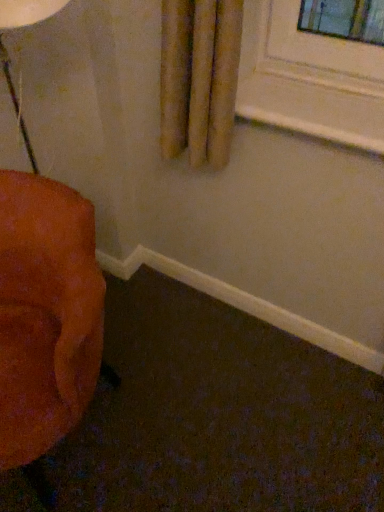
You are a GUI agent. You are given a task and a screenshot of the screen. Output one action in this format:
    pyautogui.click(x=<x>, y=<y>)
    Task: Click on the velvet orange chair at left
    
    Given the screenshot: What is the action you would take?
    pyautogui.click(x=46, y=314)

Image resolution: width=384 pixels, height=512 pixels. Describe the element at coordinates (46, 314) in the screenshot. I see `velvet orange chair at left` at that location.

Identify the location of white painted wood at upper center. (311, 130).

This screenshot has height=512, width=384. What do you see at coordinates (311, 130) in the screenshot?
I see `white painted wood at upper center` at bounding box center [311, 130].

Find the location of a particular element. This screenshot has width=384, height=512. velvet orange chair at left is located at coordinates (46, 314).

Between white painted wood at upper center and velvet orange chair at left, which one appears on the right side from the viewer's perspective?

white painted wood at upper center is more to the right.

Does white painted wood at upper center come in front of velvet orange chair at left?

No, white painted wood at upper center is further to the viewer.

Between point (383, 148) and point (23, 204), which one is positioned in front?

The point (383, 148) is closer to the camera.

From the image's perspective, is white painted wood at upper center located above or below velvet orange chair at left?

Based on their image positions, white painted wood at upper center is located above velvet orange chair at left.

From a real-world perspective, who is located higher, white painted wood at upper center or velvet orange chair at left?

white painted wood at upper center is physically above.

Is white painted wood at upper center thinner than velvet orange chair at left?

Indeed, white painted wood at upper center has a lesser width compared to velvet orange chair at left.

Does white painted wood at upper center have a greater height compared to velvet orange chair at left?

No.

Considering the relative sizes of white painted wood at upper center and velvet orange chair at left in the image provided, is white painted wood at upper center smaller than velvet orange chair at left?

Yes, white painted wood at upper center is smaller than velvet orange chair at left.

Is white painted wood at upper center not within velvet orange chair at left?

That's correct, white painted wood at upper center is outside of velvet orange chair at left.

Are white painted wood at upper center and velvet orange chair at left beside each other?

No, white painted wood at upper center is not next to velvet orange chair at left.

Could you tell me if white painted wood at upper center is turned towards velvet orange chair at left?

No, white painted wood at upper center is not aimed at velvet orange chair at left.

Measure the distance between white painted wood at upper center and velvet orange chair at left.

white painted wood at upper center is 28.28 inches from velvet orange chair at left.

The height and width of the screenshot is (512, 384). I want to click on furniture below the white painted wood at upper center (from the image's perspective), so click(46, 314).

Which object is positioned more to the left, velvet orange chair at left or white painted wood at upper center?

From the viewer's perspective, velvet orange chair at left appears more on the left side.

Considering their positions, is velvet orange chair at left located in front of or behind white painted wood at upper center?

Visually, velvet orange chair at left is located in front of white painted wood at upper center.

Is point (88, 265) behind point (277, 116)?

No.

From the image's perspective, between velvet orange chair at left and white painted wood at upper center, who is located below?

From the image's view, velvet orange chair at left is below.

From a real-world perspective, is velvet orange chair at left located higher than white painted wood at upper center?

No, from a real-world perspective, velvet orange chair at left is not above white painted wood at upper center.

Does velvet orange chair at left have a lesser width compared to white painted wood at upper center?

No, velvet orange chair at left is not thinner than white painted wood at upper center.

Considering the sizes of objects velvet orange chair at left and white painted wood at upper center in the image provided, who is taller, velvet orange chair at left or white painted wood at upper center?

With more height is velvet orange chair at left.

Considering the relative sizes of velvet orange chair at left and white painted wood at upper center in the image provided, is velvet orange chair at left bigger than white painted wood at upper center?

Yes.

Would you say velvet orange chair at left contains white painted wood at upper center?

No, white painted wood at upper center is not inside velvet orange chair at left.

Is velvet orange chair at left far from white painted wood at upper center?

No, velvet orange chair at left is in close proximity to white painted wood at upper center.

Is velvet orange chair at left aimed at white painted wood at upper center?

No, velvet orange chair at left is not oriented towards white painted wood at upper center.

Where is `window sill to the right of velvet orange chair at left`? The height and width of the screenshot is (512, 384). window sill to the right of velvet orange chair at left is located at coordinates (311, 130).

Identify the location of furniture to the left of white painted wood at upper center. The height and width of the screenshot is (512, 384). (46, 314).

Where is `window sill that appears above the velvet orange chair at left (from a real-world perspective)`? window sill that appears above the velvet orange chair at left (from a real-world perspective) is located at coordinates (311, 130).